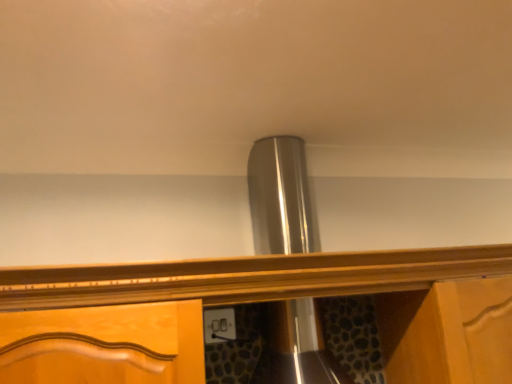
What do you see at coordinates (248, 277) in the screenshot?
I see `wooden cabinet at center` at bounding box center [248, 277].

What are the coordinates of `wooden cabinet at center` in the screenshot? It's located at (248, 277).

The image size is (512, 384). Find the location of `wooden cabinet at center`. wooden cabinet at center is located at coordinates (248, 277).